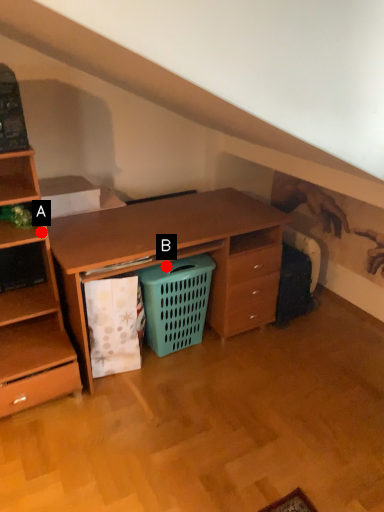
Question: Two points are circled on the image, labeled by A and B beside each circle. Among these points, which one is farthest from the camera?

Choices:
 (A) A is further
 (B) B is further

Answer: (B)